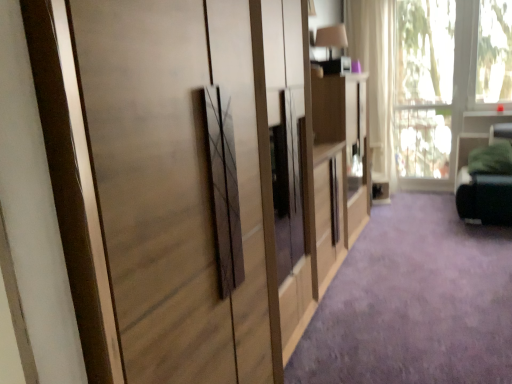
Question: Considering their positions, is transparent glass window at upper right located in front of or behind purple carpet at center?

Choices:
 (A) behind
 (B) front

Answer: (A)

Question: Based on their positions, is transparent glass window at upper right located to the left or right of purple carpet at center?

Choices:
 (A) left
 (B) right

Answer: (B)

Question: Estimate the real-world distances between objects in this image. Which object is closer to the purple carpet at center?

Choices:
 (A) matte wood dresser at center
 (B) matte wood cupboard at center
 (C) white sheer curtain at upper right
 (D) transparent glass window at upper right

Answer: (A)

Question: Which is nearer to the white sheer curtain at upper right?

Choices:
 (A) purple carpet at center
 (B) matte wood cupboard at center
 (C) matte wood dresser at center
 (D) transparent glass window at upper right

Answer: (D)